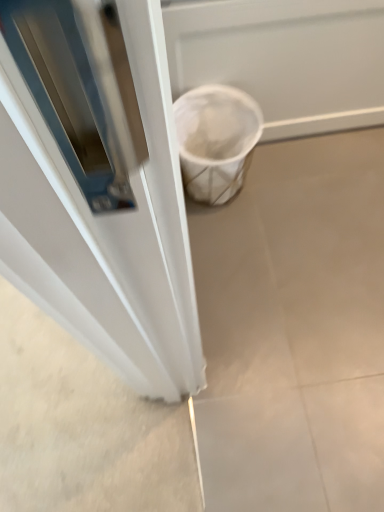
Measure the distance between point (332,404) and camera.

Point (332,404) is 1.05 meters from camera.

You are a GUI agent. You are given a task and a screenshot of the screen. Output one action in this format:
    pyautogui.click(x=<x>, y=<y>)
    Task: Click on the white matte trash can at lower right
    
    Given the screenshot: What is the action you would take?
    pyautogui.click(x=294, y=330)

What do you see at coordinates (294, 330) in the screenshot?
I see `white matte trash can at lower right` at bounding box center [294, 330].

What do you see at coordinates (285, 58) in the screenshot? The height and width of the screenshot is (512, 384). I see `white mesh screen door at lower right` at bounding box center [285, 58].

You are a GUI agent. You are given a task and a screenshot of the screen. Output one action in this format:
    pyautogui.click(x=<x>, y=<y>)
    Task: Click on the white mesh screen door at lower right
    
    Given the screenshot: What is the action you would take?
    pyautogui.click(x=285, y=58)

Where is `white matte trash can at lower right`? white matte trash can at lower right is located at coordinates (294, 330).

Visually, is white mesh screen door at lower right positioned to the left or to the right of white matte trash can at lower right?

In the image, white mesh screen door at lower right appears on the right side of white matte trash can at lower right.

Considering their positions, is white mesh screen door at lower right located in front of or behind white matte trash can at lower right?

white mesh screen door at lower right is positioned closer to the viewer than white matte trash can at lower right.

Is point (198, 76) closer or farther from the camera than point (282, 342)?

Point (198, 76) is positioned closer to the camera compared to point (282, 342).

From the image's perspective, does white mesh screen door at lower right appear higher than white matte trash can at lower right?

Indeed, from the image's perspective, white mesh screen door at lower right is shown above white matte trash can at lower right.

From a real-world perspective, is white mesh screen door at lower right located higher than white matte trash can at lower right?

Correct, in the physical world, white mesh screen door at lower right is higher than white matte trash can at lower right.

Considering the sizes of white mesh screen door at lower right and white matte trash can at lower right in the image, is white mesh screen door at lower right wider or thinner than white matte trash can at lower right?

white mesh screen door at lower right is thinner than white matte trash can at lower right.

Can you confirm if white mesh screen door at lower right is shorter than white matte trash can at lower right?

In fact, white mesh screen door at lower right may be taller than white matte trash can at lower right.

Who is smaller, white mesh screen door at lower right or white matte trash can at lower right?

white matte trash can at lower right is smaller.

Would you say white mesh screen door at lower right contains white matte trash can at lower right?

No, white matte trash can at lower right is not a part of white mesh screen door at lower right.

Is white mesh screen door at lower right far from white matte trash can at lower right?

They are positioned close to each other.

Is white mesh screen door at lower right oriented away from white matte trash can at lower right?

No, white mesh screen door at lower right's orientation is not away from white matte trash can at lower right.

Looking at this image, how different are the orientations of white mesh screen door at lower right and white matte trash can at lower right in degrees?

There is a 90.5-degree angle between the facing directions of white mesh screen door at lower right and white matte trash can at lower right.

The height and width of the screenshot is (512, 384). I want to click on concrete lying on the left of white mesh screen door at lower right, so click(294, 330).

Would you say white matte trash can at lower right is to the left or to the right of white mesh screen door at lower right in the picture?

white matte trash can at lower right is to the left of white mesh screen door at lower right.

Which object is closer to the camera taking this photo, white matte trash can at lower right or white mesh screen door at lower right?

white mesh screen door at lower right is in front.

Is point (265, 474) positioned before point (177, 38)?

Yes.

From the image's perspective, is white matte trash can at lower right on white mesh screen door at lower right?

Incorrect, from the image's perspective, white matte trash can at lower right is lower than white mesh screen door at lower right.

From a real-world perspective, which is physically below, white matte trash can at lower right or white mesh screen door at lower right?

white matte trash can at lower right, from a real-world perspective.

Does white matte trash can at lower right have a lesser width compared to white mesh screen door at lower right?

No.

Considering the sizes of objects white matte trash can at lower right and white mesh screen door at lower right in the image provided, who is shorter, white matte trash can at lower right or white mesh screen door at lower right?

white matte trash can at lower right.

Which of these two, white matte trash can at lower right or white mesh screen door at lower right, is bigger?

With larger size is white mesh screen door at lower right.

Is white mesh screen door at lower right completely or partially inside white matte trash can at lower right?

No, white matte trash can at lower right does not contain white mesh screen door at lower right.

Is white matte trash can at lower right in contact with white mesh screen door at lower right?

No, white matte trash can at lower right is not with white mesh screen door at lower right.

Could you tell me if white matte trash can at lower right is turned towards white mesh screen door at lower right?

No, white matte trash can at lower right is not oriented towards white mesh screen door at lower right.

How distant is white matte trash can at lower right from white mesh screen door at lower right?

19.03 inches.

You are a GUI agent. You are given a task and a screenshot of the screen. Output one action in this format:
    pyautogui.click(x=<x>, y=<y>)
    Task: Click on the screen door that appears on the right of white matte trash can at lower right
    The image size is (384, 512).
    Given the screenshot: What is the action you would take?
    pyautogui.click(x=285, y=58)

Where is `screen door that appears in front of the white matte trash can at lower right`? screen door that appears in front of the white matte trash can at lower right is located at coordinates (285, 58).

This screenshot has height=512, width=384. Identify the location of screen door above the white matte trash can at lower right (from the image's perspective). (285, 58).